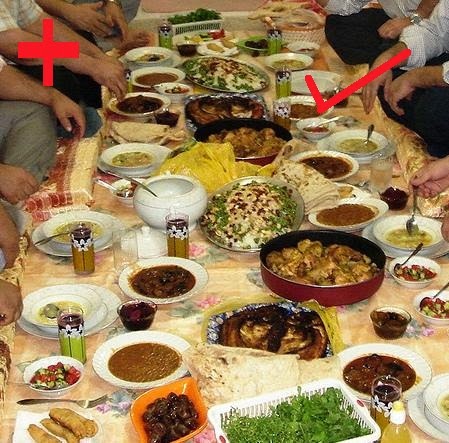
This screenshot has height=443, width=449. What are the coordinates of `tureen` in the screenshot? It's located at (185, 207).